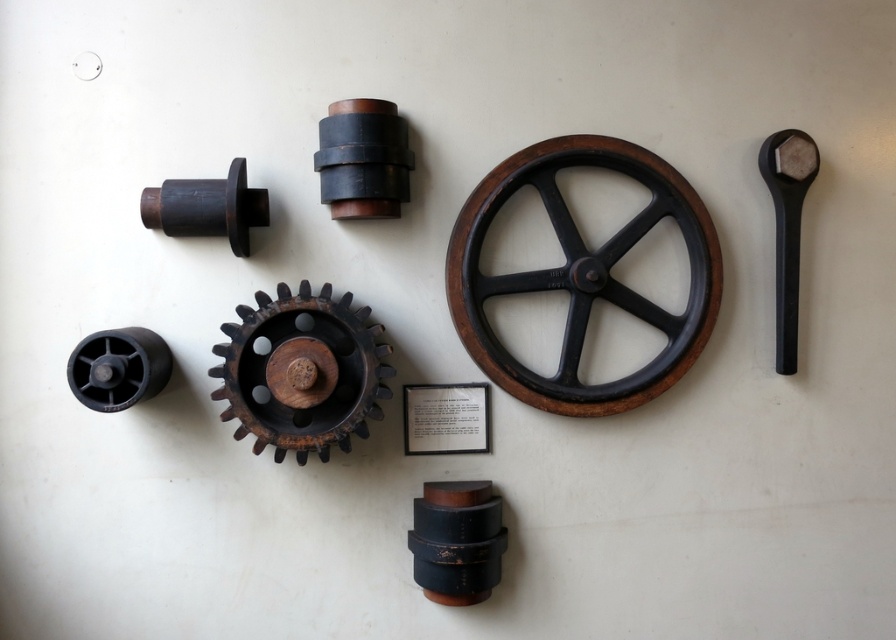
Which of these two, matte black cylinder at upper center or matte black cylinder at upper left, stands shorter?

With less height is matte black cylinder at upper left.

Is the position of matte black cylinder at upper center more distant than that of matte black cylinder at upper left?

Yes, matte black cylinder at upper center is further from the viewer.

Describe the element at coordinates (363, 160) in the screenshot. Image resolution: width=896 pixels, height=640 pixels. I see `matte black cylinder at upper center` at that location.

Locate an element on the screen. The width and height of the screenshot is (896, 640). matte black cylinder at upper center is located at coordinates (363, 160).

Is matte black cylinder at upper center to the left of black rubber wheel at lower left from the viewer's perspective?

In fact, matte black cylinder at upper center is to the right of black rubber wheel at lower left.

You are a GUI agent. You are given a task and a screenshot of the screen. Output one action in this format:
    pyautogui.click(x=<x>, y=<y>)
    Task: Click on the matte black cylinder at upper center
    
    Given the screenshot: What is the action you would take?
    pyautogui.click(x=363, y=160)

At what (x,y) coordinates should I click in order to perform the action: click on matte black cylinder at upper center. Please return your answer as a coordinate pair (x, y). Looking at the image, I should click on (363, 160).

Consider the image. Which of these two, rusty metal gear at center or matte black cylinder at upper center, stands shorter?

matte black cylinder at upper center is shorter.

Who is positioned more to the right, rusty metal gear at center or matte black cylinder at upper center?

From the viewer's perspective, matte black cylinder at upper center appears more on the right side.

The image size is (896, 640). Find the location of `rusty metal gear at center`. rusty metal gear at center is located at coordinates (302, 371).